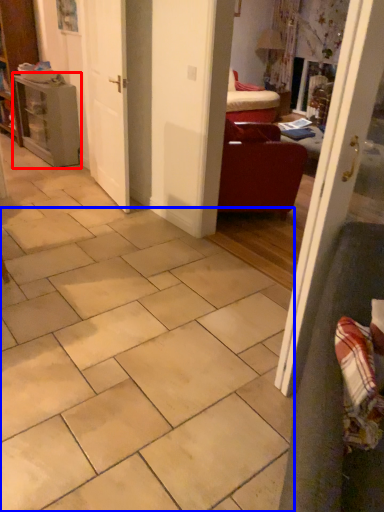
Question: Which object is further to the camera taking this photo, table (highlighted by a red box) or ceramic tile (highlighted by a blue box)?

Choices:
 (A) table
 (B) ceramic tile

Answer: (A)